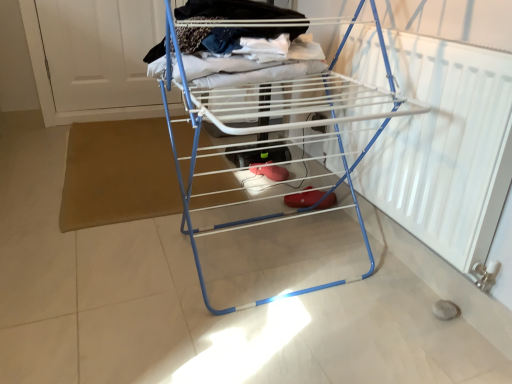
Find the location of a particular element. The image size is (512, 384). vacant area that is in front of blue metal drying rack at center is located at coordinates (267, 348).